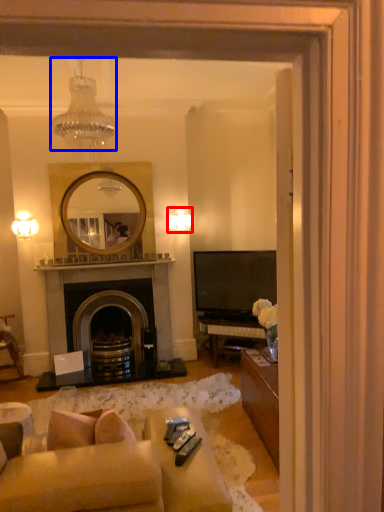
Question: Which object appears closest to the camera in this image, lamp (highlighted by a red box) or lamp (highlighted by a blue box)?

Choices:
 (A) lamp
 (B) lamp

Answer: (B)